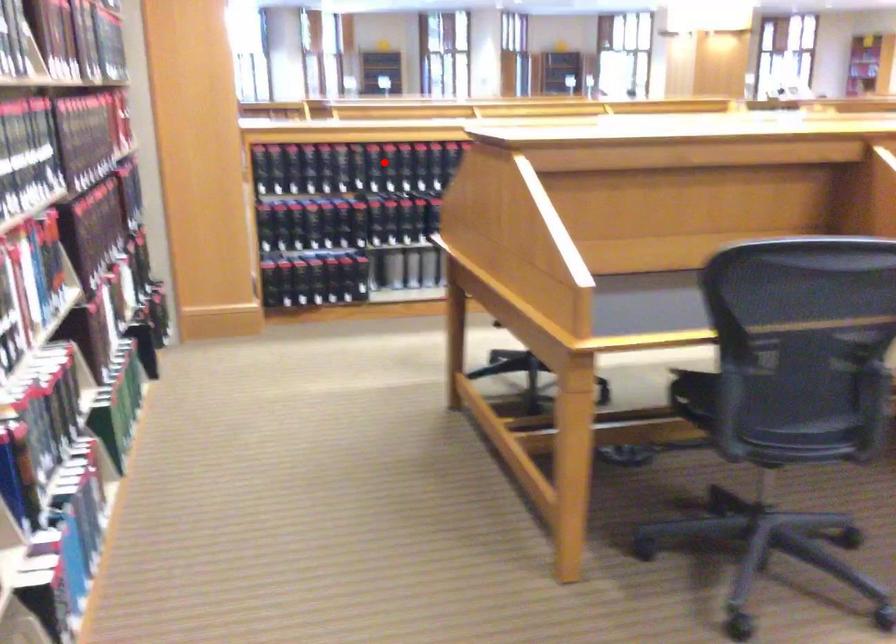
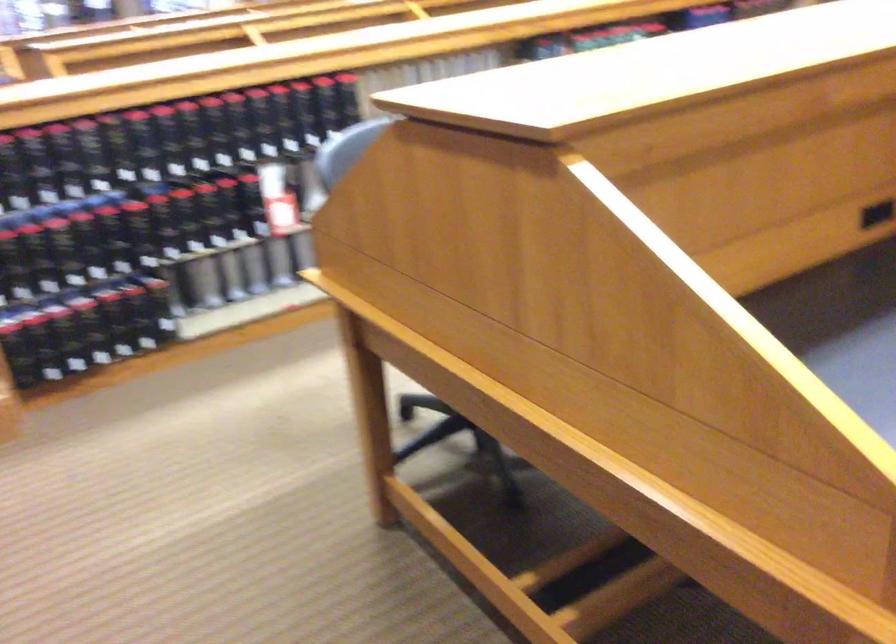
Locate, in the second image, the point that corresponds to the highlighted location in the first image.

(165, 142)